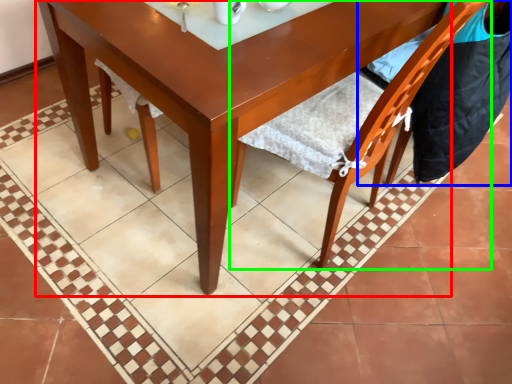
Question: Which is farther away from round table (highlighted by a red box)? chair (highlighted by a blue box) or chair (highlighted by a green box)?

Choices:
 (A) chair
 (B) chair

Answer: (A)